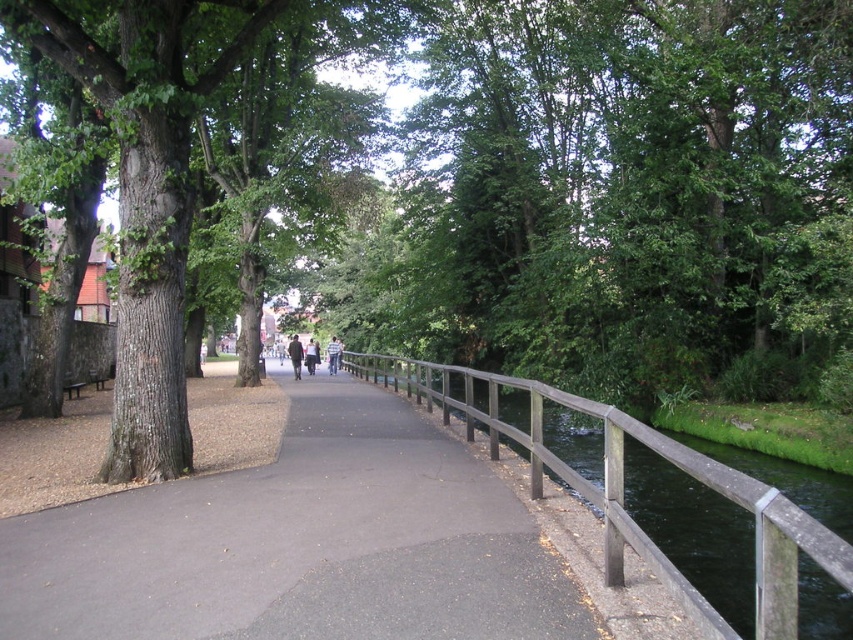
Question: Which of the following is the farthest from the observer?

Choices:
 (A) (306, 346)
 (B) (660, 456)

Answer: (A)

Question: Is dark gray asphalt at center in front of light brown leather jacket at center?

Choices:
 (A) no
 (B) yes

Answer: (B)

Question: Based on their relative distances, which object is nearer to the dark gray jacket at center?

Choices:
 (A) dark gray asphalt at center
 (B) wooden rail at right
 (C) light brown leather jacket at center
 (D) dark brown leather jacket at center

Answer: (C)

Question: Which object is farther from the camera taking this photo?

Choices:
 (A) dark brown leather jacket at center
 (B) dark gray asphalt at center

Answer: (A)

Question: Can you confirm if wooden rail at right is positioned to the left of dark gray jacket at center?

Choices:
 (A) no
 (B) yes

Answer: (A)

Question: Does dark gray asphalt at center appear on the left side of dark gray jacket at center?

Choices:
 (A) yes
 (B) no

Answer: (B)